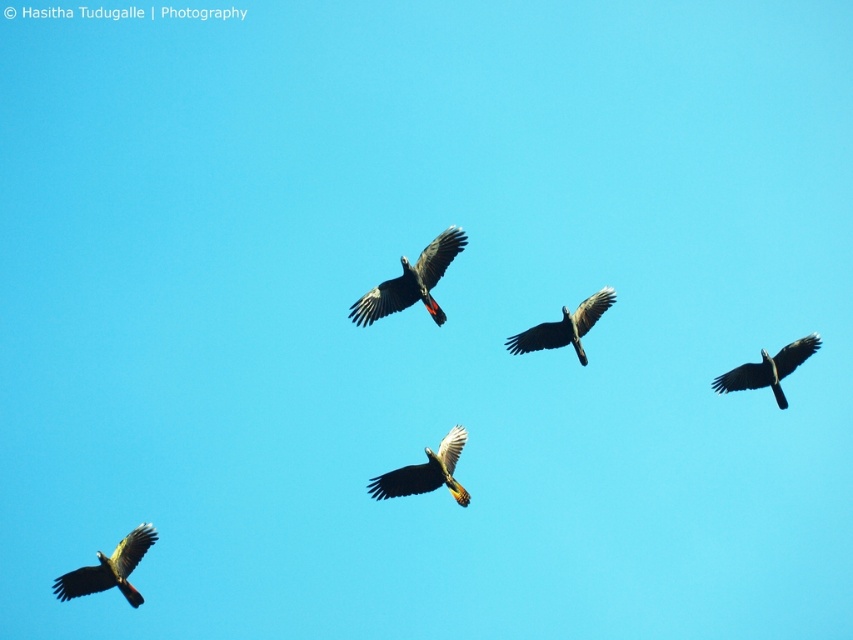
Between point (140, 556) and point (412, 472), which one is positioned behind?

Positioned behind is point (140, 556).

Between shiny green parrot at bottom left and yellow-green feathers at center, which one appears on the left side from the viewer's perspective?

shiny green parrot at bottom left

Find the location of a particular element. shiny green parrot at bottom left is located at coordinates (109, 568).

Does point (379, 316) come farther from viewer compared to point (776, 380)?

No, it is in front of (776, 380).

Is point (376, 314) in front of point (805, 348)?

Yes, it is.

Find the location of a particular element. black glossy parrot at center is located at coordinates (410, 282).

Who is shorter, black glossy parrot at center or yellow-green feathers at center?

yellow-green feathers at center

Between point (403, 272) and point (384, 472), which one is positioned behind?

The point (384, 472) is behind.

Who is more distant from viewer, (433, 250) or (404, 474)?

The point (404, 474) is more distant.

Find the location of `black glossy parrot at center`. black glossy parrot at center is located at coordinates (410, 282).